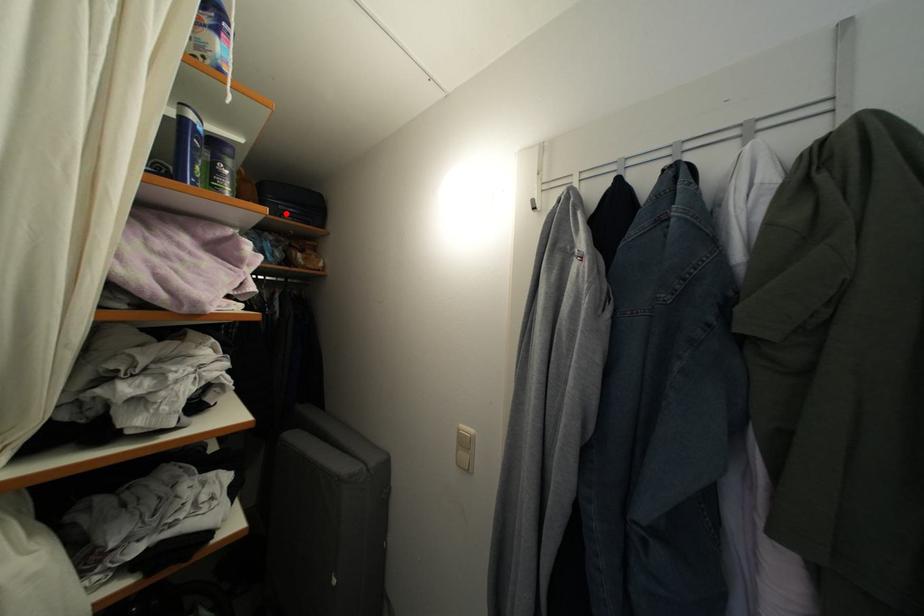
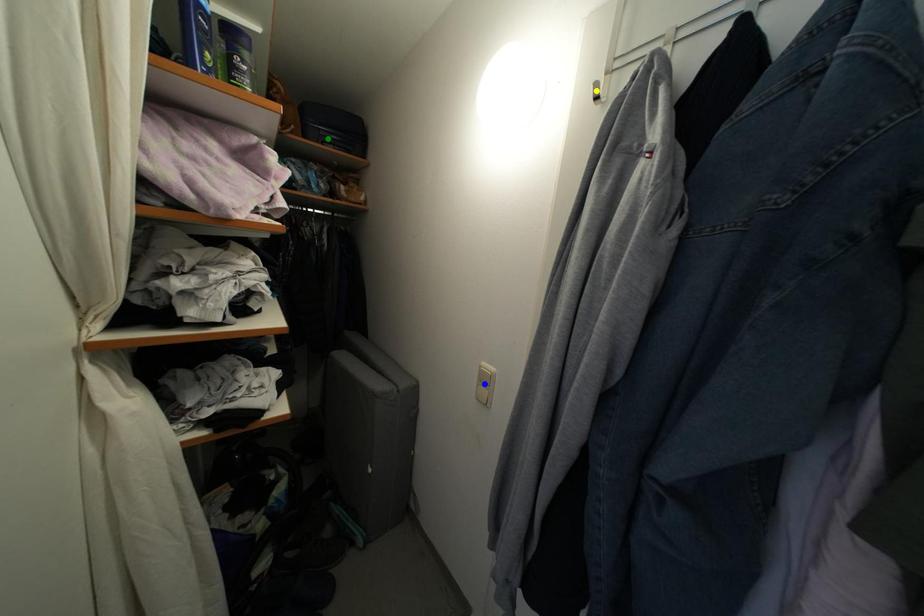
Question: I am providing you with two images of the same scene from different viewpoints. A red point is marked on the first image. You are given multiple points on the second image. Which point in image 2 represents the same 3d spot as the red point in image 1?

Choices:
 (A) green point
 (B) yellow point
 (C) blue point

Answer: (A)